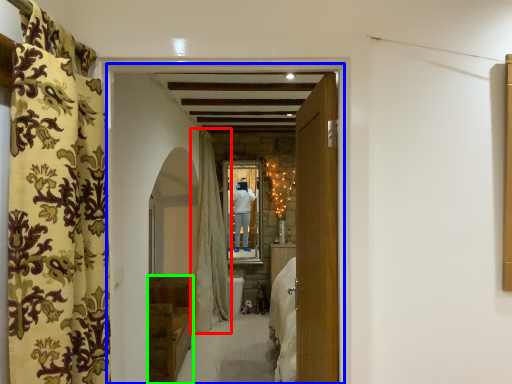
Question: Estimate the real-world distances between objects in this image. Which object is closer to curtain (highlighted by a red box), hotel lobby (highlighted by a blue box) or furniture (highlighted by a green box)?

Choices:
 (A) hotel lobby
 (B) furniture

Answer: (B)